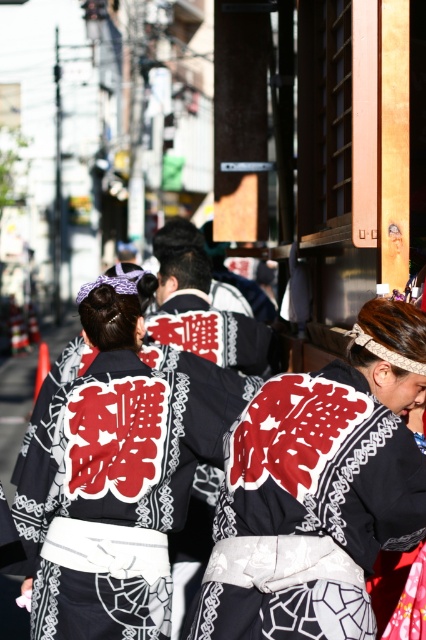
Does point (377, 460) lie behind point (112, 490)?

No, (377, 460) is in front of (112, 490).

Between black fabric kimono at center and black silk kimono at center, which one appears on the right side from the viewer's perspective?

From the viewer's perspective, black fabric kimono at center appears more on the right side.

I want to click on black fabric kimono at center, so click(x=319, y=492).